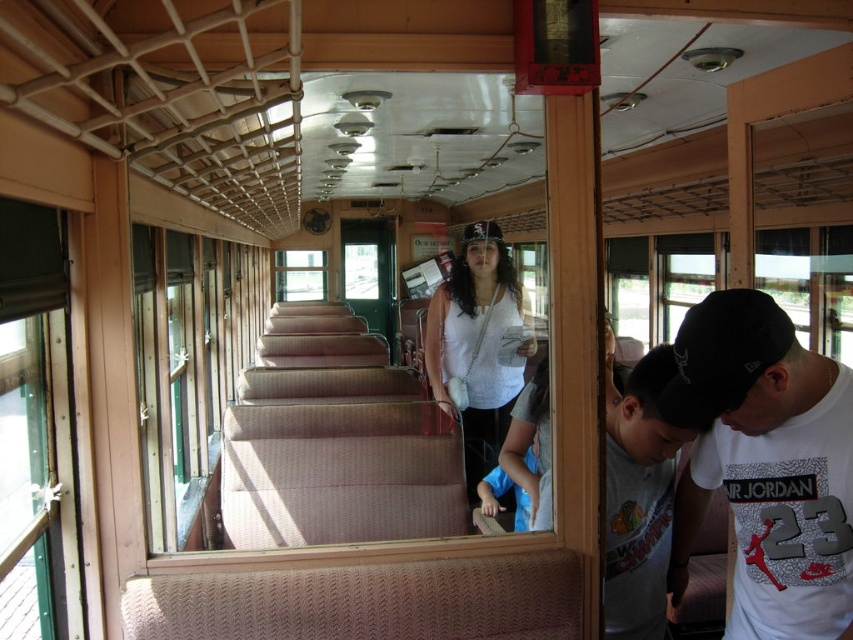
Question: Considering the relative positions of white cotton t-shirt at lower right and white matte tank top at center in the image provided, where is white cotton t-shirt at lower right located with respect to white matte tank top at center?

Choices:
 (A) right
 (B) left

Answer: (A)

Question: Does white cotton t-shirt at lower right appear on the right side of white matte tank top at center?

Choices:
 (A) no
 (B) yes

Answer: (B)

Question: Can you confirm if white cotton t-shirt at lower right is positioned to the right of white matte tank top at center?

Choices:
 (A) yes
 (B) no

Answer: (A)

Question: Which object appears farthest from the camera in this image?

Choices:
 (A) white cotton t-shirt at lower right
 (B) white matte tank top at center

Answer: (B)

Question: Which point is closer to the camera?

Choices:
 (A) white matte tank top at center
 (B) white cotton t-shirt at lower right

Answer: (B)